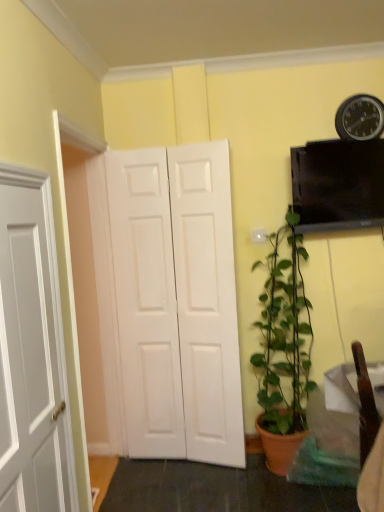
Question: Is white matte door at center behind metallic black clock at upper right?

Choices:
 (A) no
 (B) yes

Answer: (A)

Question: Considering the relative sizes of white matte door at center and metallic black clock at upper right in the image provided, is white matte door at center shorter than metallic black clock at upper right?

Choices:
 (A) yes
 (B) no

Answer: (B)

Question: Can you confirm if white matte door at center is positioned to the left of metallic black clock at upper right?

Choices:
 (A) yes
 (B) no

Answer: (A)

Question: Is white matte door at center at the right side of metallic black clock at upper right?

Choices:
 (A) no
 (B) yes

Answer: (A)

Question: Considering the relative sizes of white matte door at center and metallic black clock at upper right in the image provided, is white matte door at center wider than metallic black clock at upper right?

Choices:
 (A) yes
 (B) no

Answer: (A)

Question: Can you confirm if white matte door at center is thinner than metallic black clock at upper right?

Choices:
 (A) no
 (B) yes

Answer: (A)

Question: Is green matte plant at lower right further to camera compared to metallic black clock at upper right?

Choices:
 (A) no
 (B) yes

Answer: (A)

Question: Is green matte plant at lower right oriented towards metallic black clock at upper right?

Choices:
 (A) yes
 (B) no

Answer: (B)

Question: Are green matte plant at lower right and metallic black clock at upper right located far from each other?

Choices:
 (A) yes
 (B) no

Answer: (A)

Question: Considering the relative sizes of green matte plant at lower right and metallic black clock at upper right in the image provided, is green matte plant at lower right wider than metallic black clock at upper right?

Choices:
 (A) yes
 (B) no

Answer: (A)

Question: Is green matte plant at lower right positioned beyond the bounds of metallic black clock at upper right?

Choices:
 (A) yes
 (B) no

Answer: (A)

Question: Is green matte plant at lower right positioned before metallic black clock at upper right?

Choices:
 (A) yes
 (B) no

Answer: (A)

Question: Is metallic black clock at upper right thinner than white matte door at center?

Choices:
 (A) no
 (B) yes

Answer: (B)